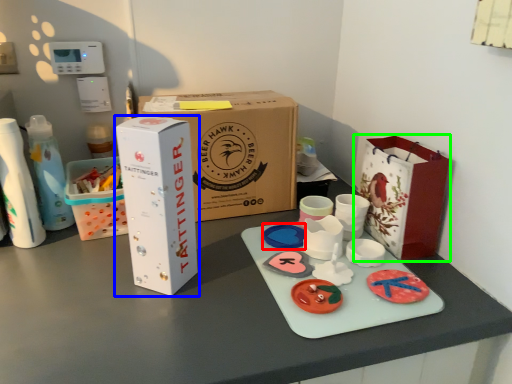
Question: Which is nearer to the toy (highlighted by a red box)? box (highlighted by a blue box) or paper bag (highlighted by a green box).

Choices:
 (A) box
 (B) paper bag

Answer: (B)